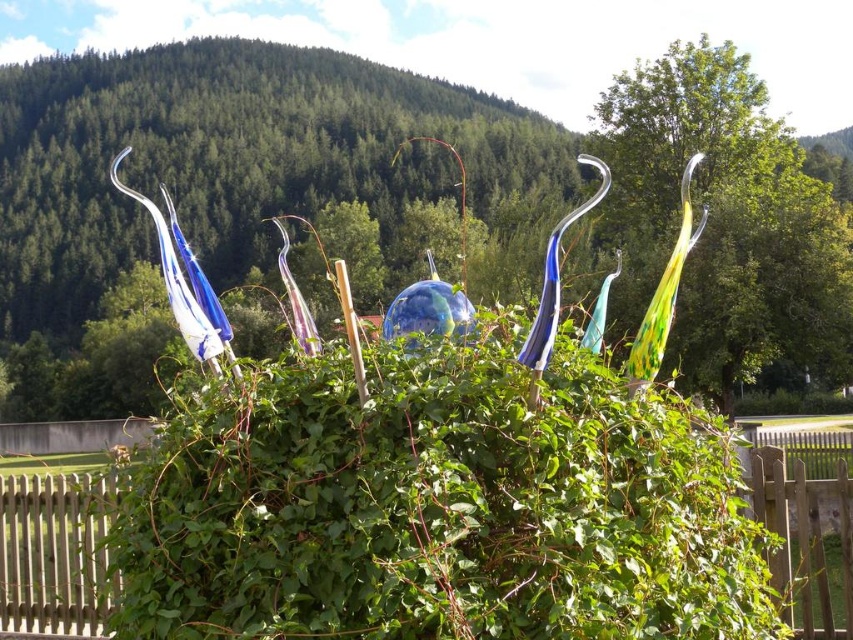
Question: Is green leafy bush at center to the left of wooden fence at lower right from the viewer's perspective?

Choices:
 (A) yes
 (B) no

Answer: (A)

Question: Can you confirm if green leafy bush at center is positioned to the left of wooden fence at lower right?

Choices:
 (A) yes
 (B) no

Answer: (A)

Question: Which point is farther from the camera taking this photo?

Choices:
 (A) (822, 605)
 (B) (102, 568)

Answer: (B)

Question: Does green leafy bush at center appear under white wooden fence at lower left?

Choices:
 (A) yes
 (B) no

Answer: (B)

Question: Which point is farther to the camera?

Choices:
 (A) [x=102, y=492]
 (B) [x=607, y=445]

Answer: (A)

Question: Estimate the real-world distances between objects in this image. Which object is farther from the wooden fence at lower right?

Choices:
 (A) white wooden fence at lower left
 (B) green leafy bush at center

Answer: (A)